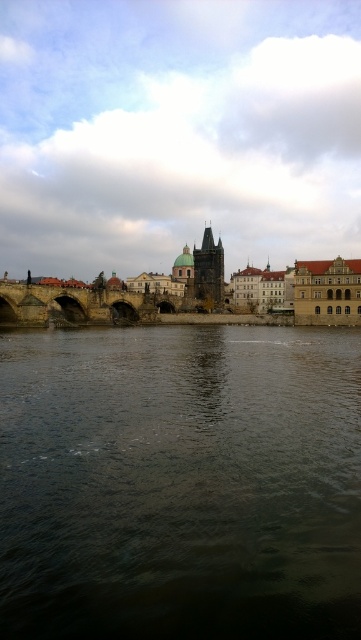
Does dark brown water at center appear on the left side of stone bridge at center?

Incorrect, dark brown water at center is not on the left side of stone bridge at center.

Image resolution: width=361 pixels, height=640 pixels. What do you see at coordinates (180, 483) in the screenshot? I see `dark brown water at center` at bounding box center [180, 483].

Is point (162, 560) closer to viewer compared to point (72, 301)?

Yes, point (162, 560) is closer to viewer.

Find the location of a particular element. This screenshot has height=640, width=361. dark brown water at center is located at coordinates (180, 483).